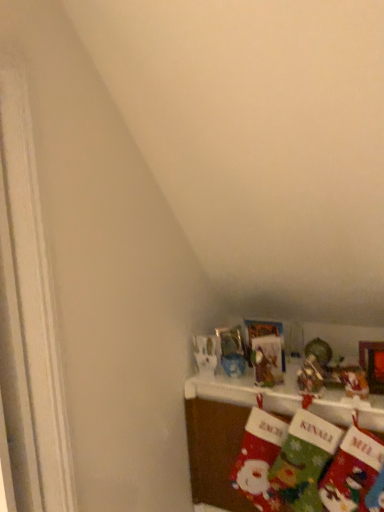
This screenshot has height=512, width=384. Identify the location of empty space that is to the right of metallic silver ornament at upper center, the 2th toy from the right. (329, 388).